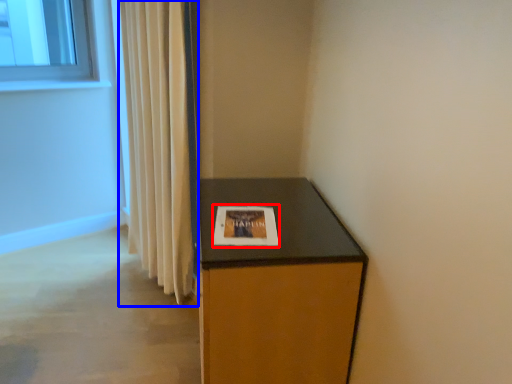
Question: Among these objects, which one is farthest to the camera, picture frame (highlighted by a red box) or curtain (highlighted by a blue box)?

Choices:
 (A) picture frame
 (B) curtain

Answer: (B)